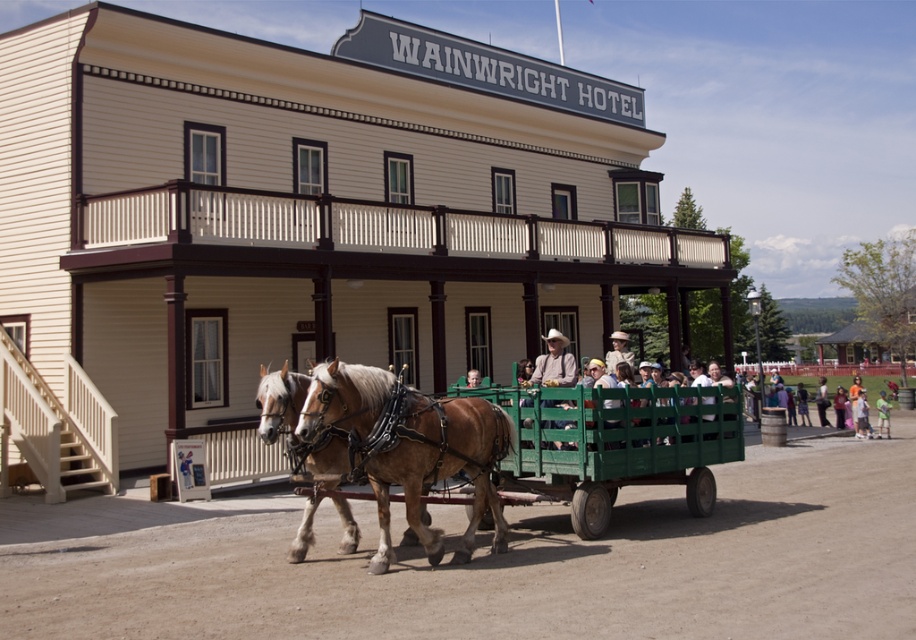
Based on the photo, you are a photographer standing at the back of the wagon. You want to take a photo of the light blue denim shirt at lower right without the light brown leather horse at center blocking the view. Is this possible?

The light brown leather horse at center is much taller than the light blue denim shirt at lower right, so the horse will block the view of the light blue denim shirt at lower right.

You are a photographer standing in front of the Wainwright Hotel. You notice two people in the lower right corner of your viewfinder wearing orange cotton shirt at lower right and blurred cotton shirt at lower right. Which of these two shirts is positioned more to the left in your view?

The orange cotton shirt at lower right is positioned to the left of the blurred cotton shirt at lower right.

You are a photographer standing in front of the Wainwright Hotel. You want to take a photo of the light brown leather horse at center and the light blue denim shirt at lower right. Which object should you focus on first if you want to capture both in the same frame without moving the camera?

The light brown leather horse at center is located above the light blue denim shirt at lower right, so you should focus on the light brown leather horse at center first to ensure both are in the frame.